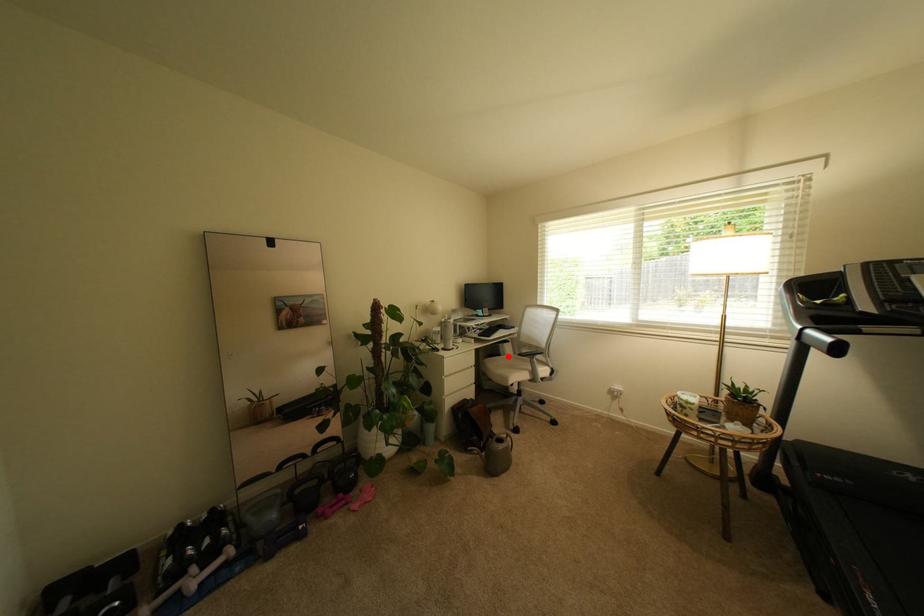
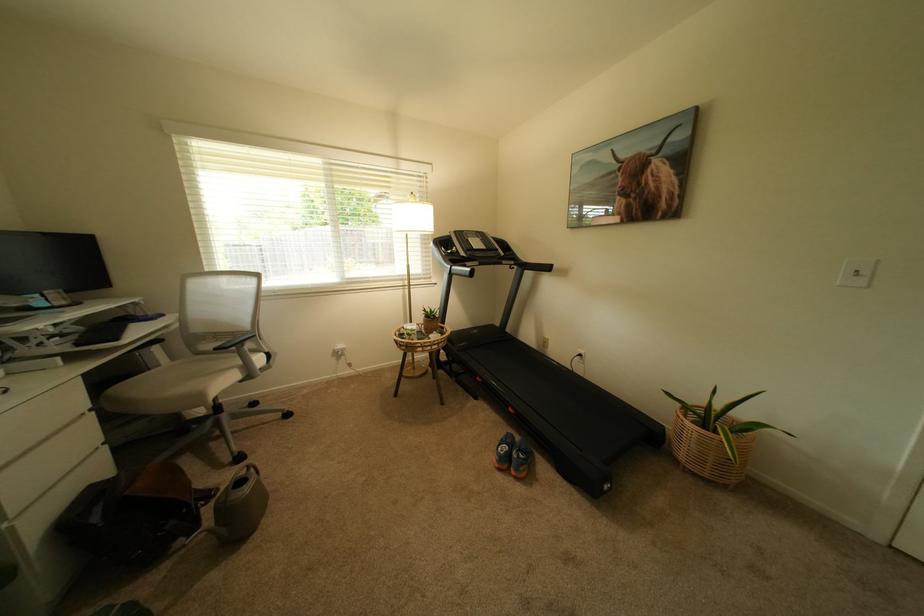
Question: I am providing you with two images of the same scene from different viewpoints. Given a red point in image1, look at the same physical point in image2. Is it:

Choices:
 (A) Closer to the viewpoint
 (B) Farther from the viewpoint

Answer: (A)